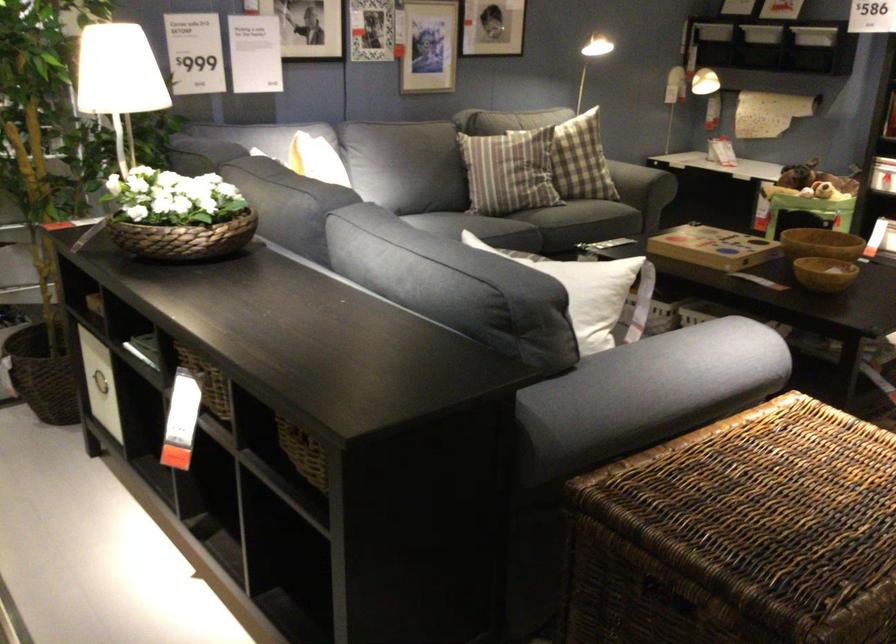
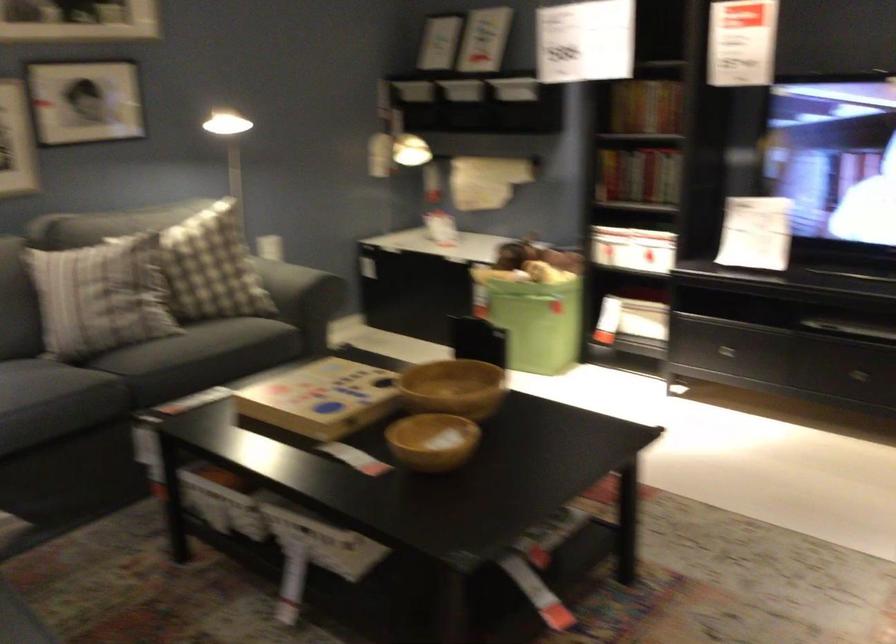
Find the pixel in the second image that matches [737,245] in the first image.

(320, 399)